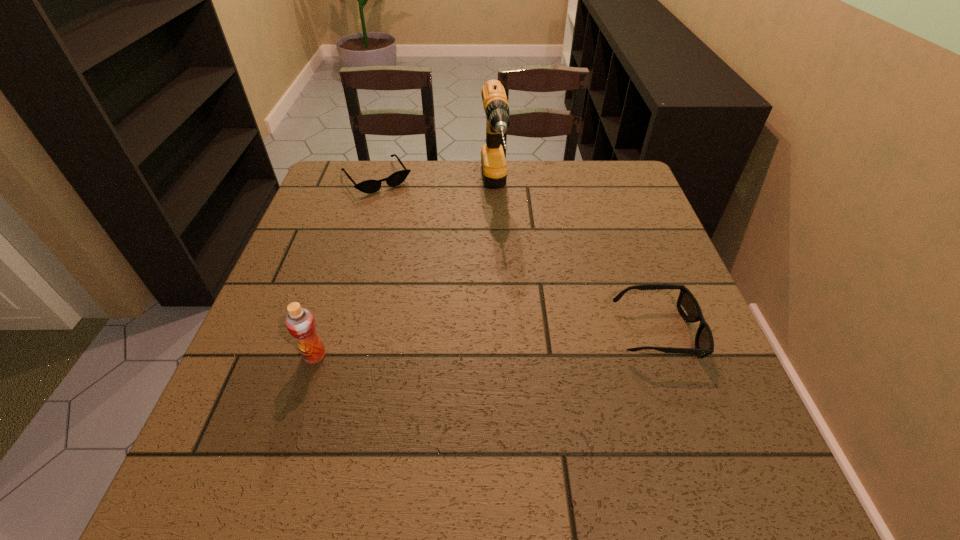
The image size is (960, 540). What are the coordinates of `free space located at the tip of the drill` in the screenshot? It's located at (513, 334).

You are a GUI agent. You are given a task and a screenshot of the screen. Output one action in this format:
    pyautogui.click(x=<x>, y=<y>)
    Task: Click on the vacant space located on the front-facing side of the shortest object
    
    Given the screenshot: What is the action you would take?
    pyautogui.click(x=449, y=273)

This screenshot has width=960, height=540. Identify the location of free space located on the front-facing side of the shortest object. (449, 273).

Image resolution: width=960 pixels, height=540 pixels. Identify the location of free point located on the front-facing side of the shortest object. point(447,270).

You are a GUI agent. You are given a task and a screenshot of the screen. Output one action in this format:
    pyautogui.click(x=<x>, y=<y>)
    Task: Click on the drill located at the far edge
    The image size is (960, 540).
    Given the screenshot: What is the action you would take?
    pyautogui.click(x=495, y=102)

The image size is (960, 540). I want to click on sunglasses that is at the far edge, so click(x=368, y=186).

The height and width of the screenshot is (540, 960). What are the coordinates of `orange juice present at the left edge` in the screenshot? It's located at (300, 322).

I want to click on sunglasses that is at the left edge, so click(x=368, y=186).

This screenshot has height=540, width=960. I want to click on object located at the right edge, so click(687, 305).

Find the location of a particular element. The image size is (960, 540). object present at the far left corner is located at coordinates (368, 186).